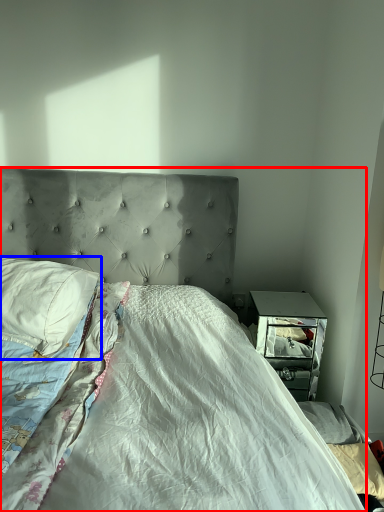
Question: Which object is closer to the camera taking this photo, bed (highlighted by a red box) or pillow (highlighted by a blue box)?

Choices:
 (A) bed
 (B) pillow

Answer: (A)